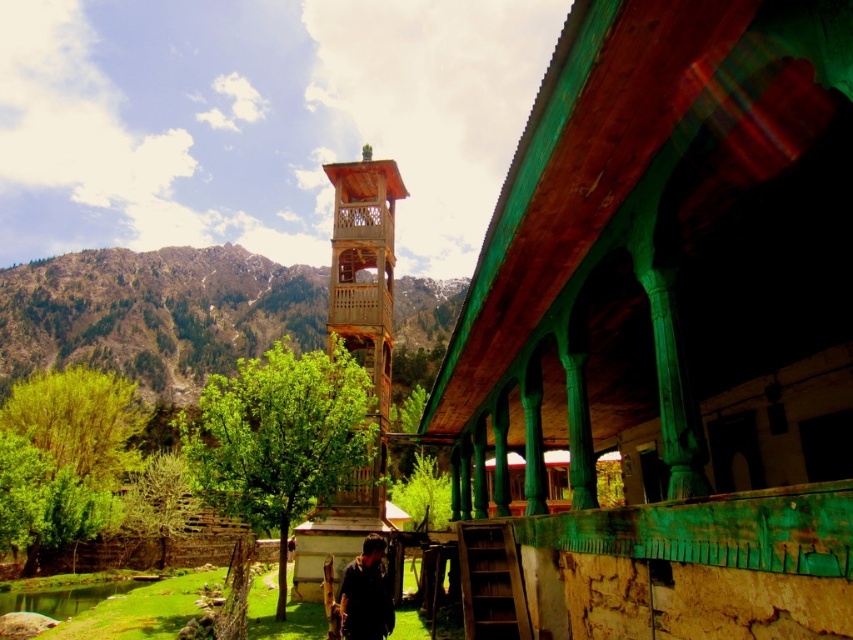
From the picture: You are standing at the entrance of the structure and want to reach the wooden lattice bell tower at center. There is a dark blue shirt at center blocking your path. Can you walk straight ahead to reach the bell tower without going around?

The wooden lattice bell tower at center is 70.83 feet away from dark blue shirt at center. Since the dark blue shirt at center is blocking your path, you can still walk straight ahead to reach the bell tower as the distance allows you to go past the person.

You are an architect analyzing the structure of the building in the scene. Based on the image, which object, the green painted wood at center or the wooden lattice bell tower at center, has a larger width when viewed from your perspective?

The green painted wood at center is wider than the wooden lattice bell tower at center according to the description.

From the picture: You are standing in front of the wooden lattice bell tower at center and the dark blue shirt at center. If you want to take a photo that includes both objects, which one should you position closer to the camera to ensure both fit in the frame?

Since the wooden lattice bell tower at center is wider than the dark blue shirt at center, you should position the dark blue shirt at center closer to the camera to ensure both fit in the frame.